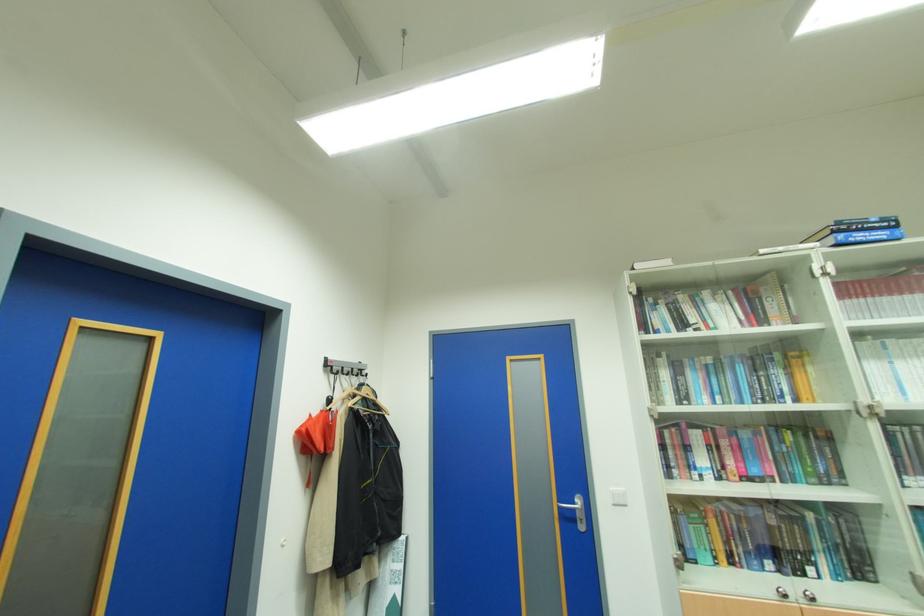
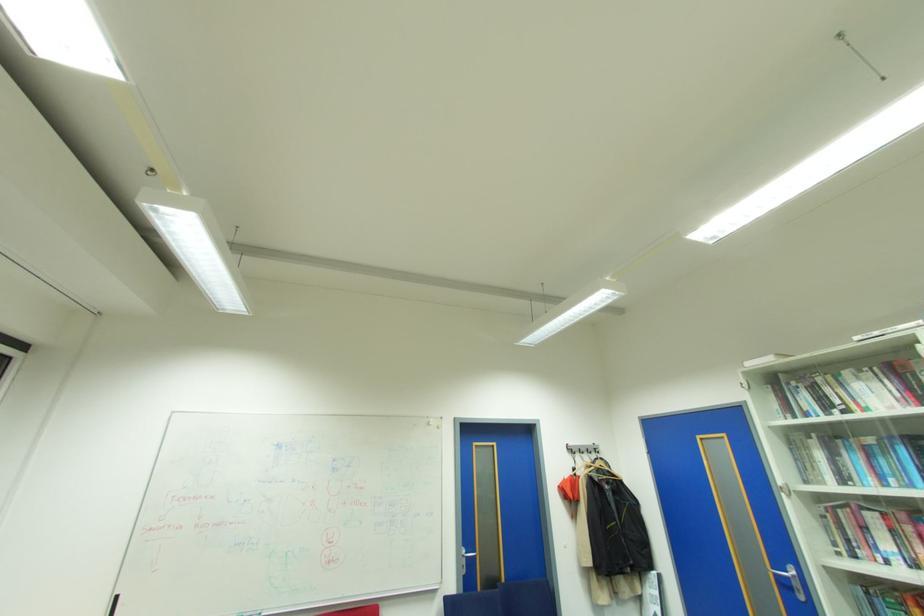
Where in the second image is the point corresponding to point 333,363 from the first image?

(573, 448)